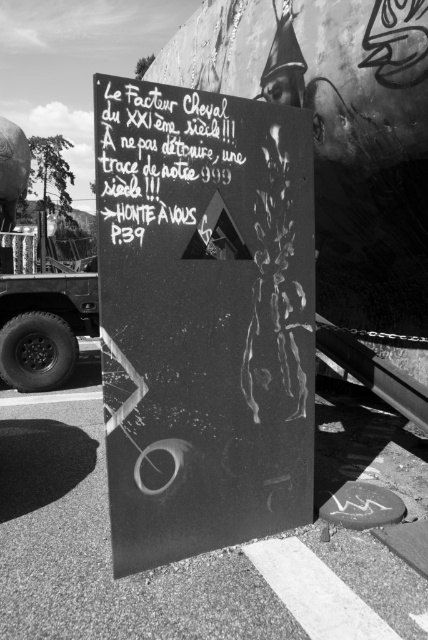
Question: Can you confirm if black matte sign at center is smaller than black chalkboard sign at upper center?

Choices:
 (A) no
 (B) yes

Answer: (A)

Question: Which of the following is the closest to the observer?

Choices:
 (A) black matte sign at center
 (B) metallic truck tire at left

Answer: (A)

Question: Can you confirm if black chalkboard sign at upper center is bigger than metallic truck tire at left?

Choices:
 (A) no
 (B) yes

Answer: (A)

Question: Does black matte sign at center appear over black chalkboard sign at upper center?

Choices:
 (A) no
 (B) yes

Answer: (A)

Question: Estimate the real-world distances between objects in this image. Which object is closer to the black matte sign at center?

Choices:
 (A) metallic truck tire at left
 (B) black chalkboard sign at upper center

Answer: (B)

Question: Which object is farther from the camera taking this photo?

Choices:
 (A) black chalkboard sign at upper center
 (B) black matte sign at center

Answer: (A)